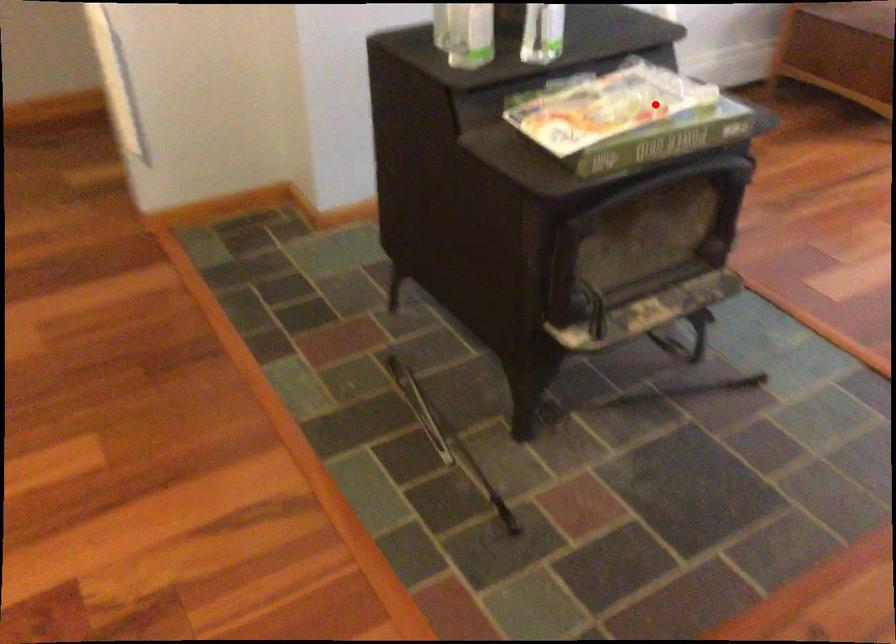
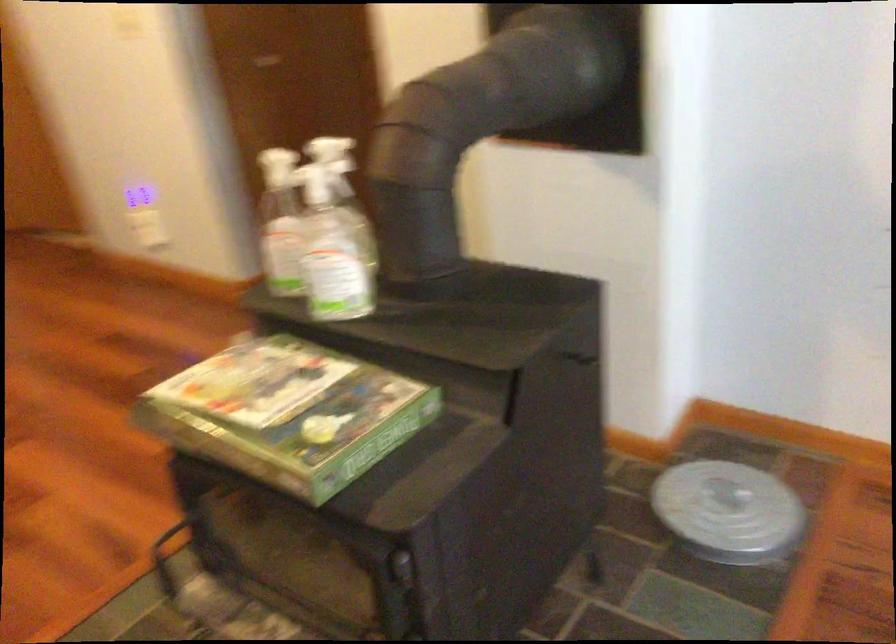
Question: I am providing you with two images of the same scene from different viewpoints. A red point is shown in image1. For the corresponding object point in image2, is it positioned nearer or farther from the camera?

Choices:
 (A) Nearer
 (B) Farther

Answer: (A)